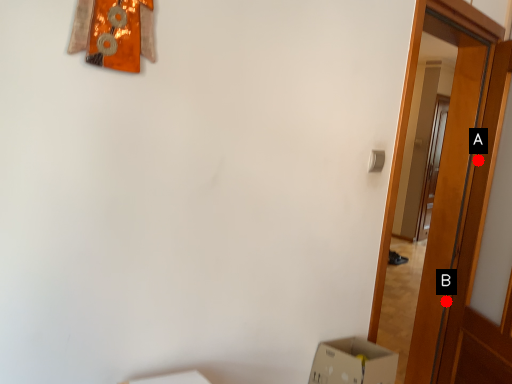
Question: Two points are circled on the image, labeled by A and B beside each circle. Among these points, which one is nearest to the camera?

Choices:
 (A) A is closer
 (B) B is closer

Answer: (A)